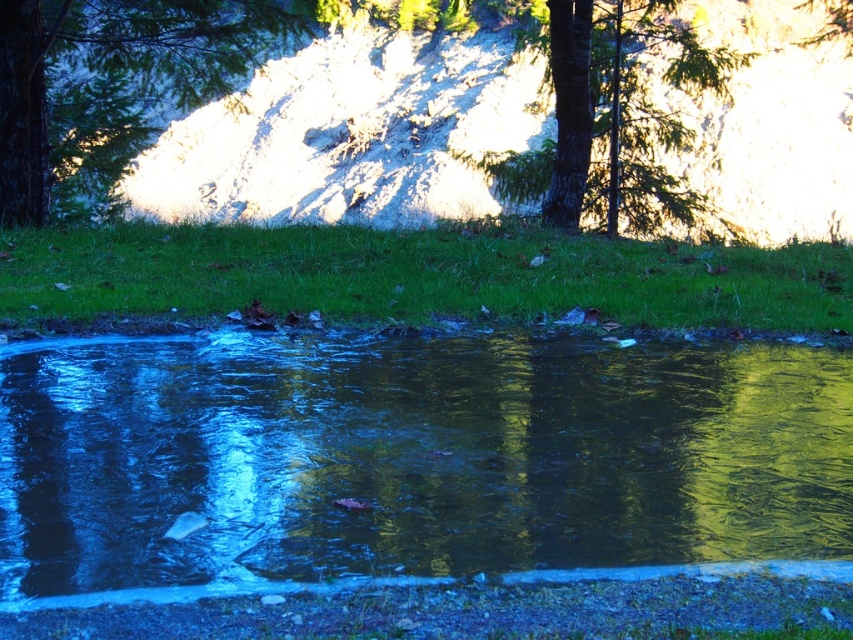
Is green textured tree at upper left below green textured tree at center?

Correct, green textured tree at upper left is located below green textured tree at center.

Measure the distance from green textured tree at upper left to green textured tree at center.

green textured tree at upper left is 5.65 meters from green textured tree at center.

This screenshot has height=640, width=853. Describe the element at coordinates (109, 84) in the screenshot. I see `green textured tree at upper left` at that location.

Where is `green textured tree at upper left`? This screenshot has width=853, height=640. green textured tree at upper left is located at coordinates 109,84.

Does clear liquid water at center lie in front of green textured tree at upper left?

Yes, clear liquid water at center is in front of green textured tree at upper left.

Based on the photo, which of these two, clear liquid water at center or green textured tree at upper left, stands shorter?

clear liquid water at center is shorter.

Is point (141, 500) farther from viewer compared to point (151, 81)?

No, it is in front of (151, 81).

You are a GUI agent. You are given a task and a screenshot of the screen. Output one action in this format:
    pyautogui.click(x=<x>, y=<y>)
    Task: Click on the clear liquid water at center
    
    Given the screenshot: What is the action you would take?
    pyautogui.click(x=410, y=456)

Which is more to the left, clear liquid water at center or green textured tree at center?

From the viewer's perspective, clear liquid water at center appears more on the left side.

Does clear liquid water at center lie in front of green textured tree at center?

Yes.

What do you see at coordinates (410, 456) in the screenshot? The height and width of the screenshot is (640, 853). I see `clear liquid water at center` at bounding box center [410, 456].

Find the location of a particular element. The height and width of the screenshot is (640, 853). clear liquid water at center is located at coordinates (410, 456).